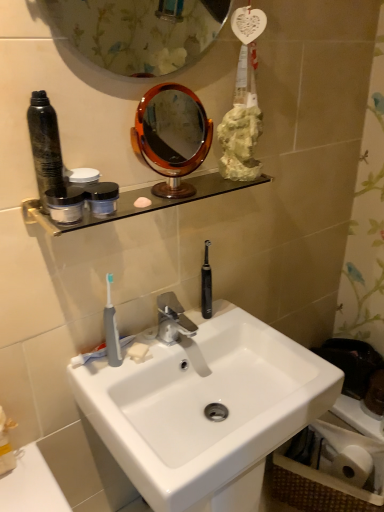
Where is `vacant region to the right of white matte soap at sink`? This screenshot has height=512, width=384. vacant region to the right of white matte soap at sink is located at coordinates (196, 332).